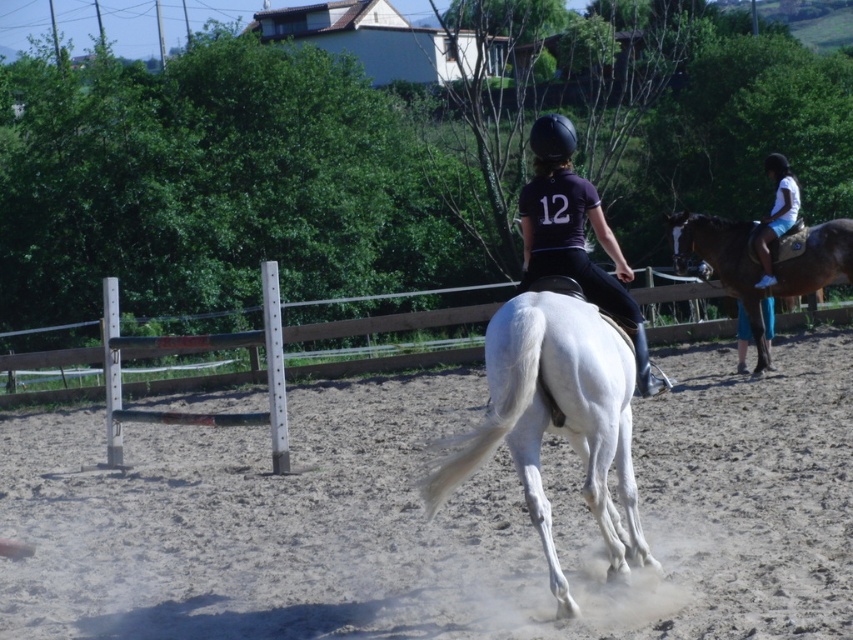
Is point (538, 314) positioned behind point (689, 246)?

No, it is in front of (689, 246).

Is white glossy horse at center shorter than brown glossy horse at right?

Correct, white glossy horse at center is not as tall as brown glossy horse at right.

Who is more forward, (561, 588) or (817, 285)?

Point (561, 588) is more forward.

Identify the location of white glossy horse at center. (556, 417).

From the picture: Who is positioned more to the left, dusty sand at center or matte black jockey at center?

dusty sand at center

Is point (155, 588) less distant than point (549, 218)?

That is False.

Locate an element on the screen. The width and height of the screenshot is (853, 640). dusty sand at center is located at coordinates (440, 516).

Is dusty sand at center closer to camera compared to white glossy horse at center?

Result: No.

Which is above, dusty sand at center or white glossy horse at center?

white glossy horse at center

I want to click on dusty sand at center, so click(440, 516).

The image size is (853, 640). In order to click on dusty sand at center in this screenshot , I will do `click(440, 516)`.